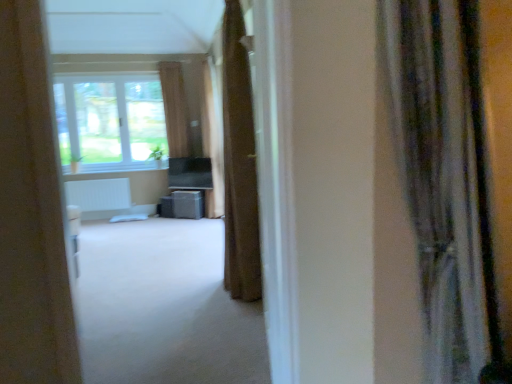
Question: Does point (97, 380) appear closer or farther from the camera than point (202, 74)?

Choices:
 (A) closer
 (B) farther

Answer: (A)

Question: From the image's perspective, is white carpet at center positioned above or below brown fabric curtain at center, acting as the third curtain starting from the right?

Choices:
 (A) below
 (B) above

Answer: (A)

Question: Which of these objects is positioned farthest from the brown fabric curtain at center, which is the 4th curtain from right to left?

Choices:
 (A) matte gray speaker at center
 (B) brown fabric curtain at center, which is the second curtain from right to left
 (C) silky gray curtain at right, placed as the 4th curtain when sorted from left to right
 (D) white carpet at center
 (E) brown fabric curtain at center, which is the 2th curtain from left to right

Answer: (C)

Question: Estimate the real-world distances between objects in this image. Which object is closer to the silky gray curtain at right, the first curtain in the right-to-left sequence?

Choices:
 (A) white carpet at center
 (B) brown fabric curtain at center, the 3th curtain viewed from the left
 (C) brown fabric curtain at center, which appears as the fourth curtain when viewed from the front
 (D) matte gray speaker at center
 (E) brown fabric curtain at center, placed as the third curtain when sorted from front to back

Answer: (B)